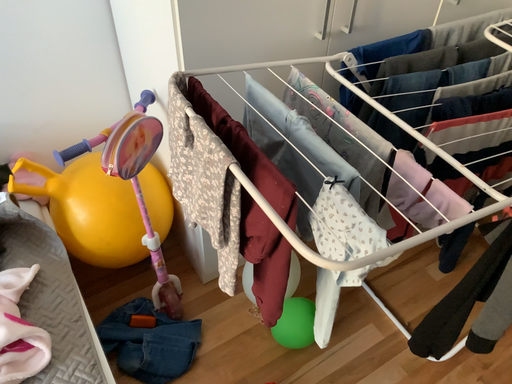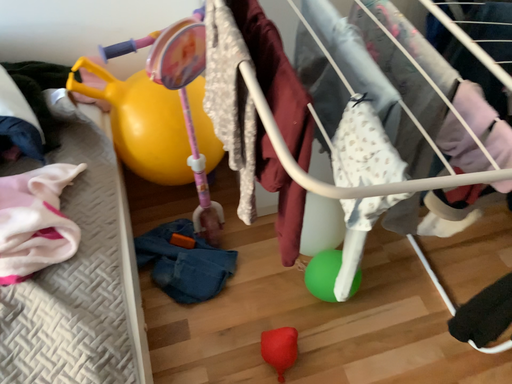
Question: Which way did the camera rotate in the video?

Choices:
 (A) rotated left
 (B) rotated right

Answer: (A)